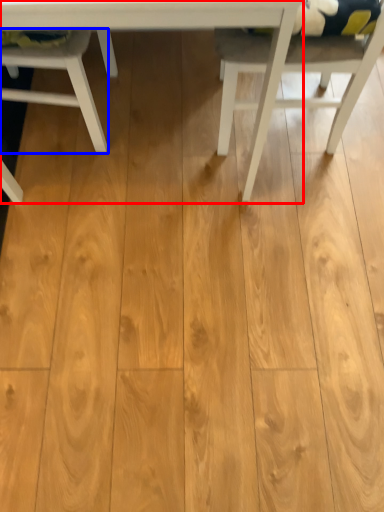
Question: Among these objects, which one is farthest to the camera, table (highlighted by a red box) or chair (highlighted by a blue box)?

Choices:
 (A) table
 (B) chair

Answer: (B)